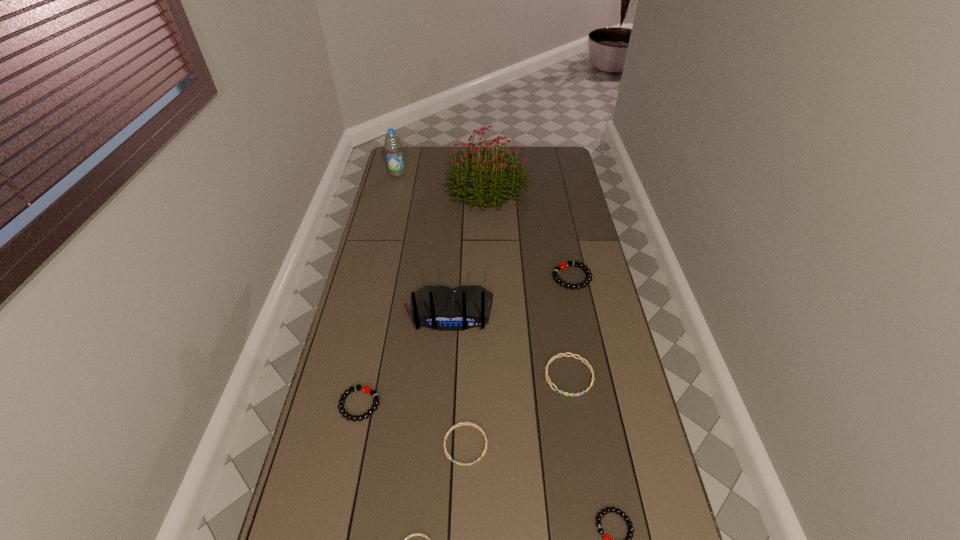
The height and width of the screenshot is (540, 960). What are the coordinates of `the leftmost black bracelet` in the screenshot? It's located at (368, 390).

I want to click on the second smallest black bracelet, so click(x=368, y=390).

The height and width of the screenshot is (540, 960). What are the coordinates of `the second blue bracelet from left to right` in the screenshot? It's located at (464, 423).

Identify the location of the second smallest blue bracelet. (464, 423).

Locate an element on the screen. This screenshot has width=960, height=540. vacant space situated on the back of the tallest object is located at coordinates (487, 160).

The height and width of the screenshot is (540, 960). What are the coordinates of `free location located on the right of the water bottle` in the screenshot? It's located at (482, 174).

At what (x,y) coordinates should I click in order to perform the action: click on vacant region located 0.090m on the back of the black router. Please return your answer as a coordinate pair (x, y). The image size is (960, 540). Looking at the image, I should click on (449, 357).

Image resolution: width=960 pixels, height=540 pixels. Identify the location of vacant area located on the front of the farthest black bracelet. (587, 348).

This screenshot has height=540, width=960. Identify the location of free region located on the surface of the biggest blue bracelet showing star-shaped elements. (577, 423).

The height and width of the screenshot is (540, 960). In order to click on blank space located on the right of the leftmost black bracelet in this screenshot , I will do `click(480, 404)`.